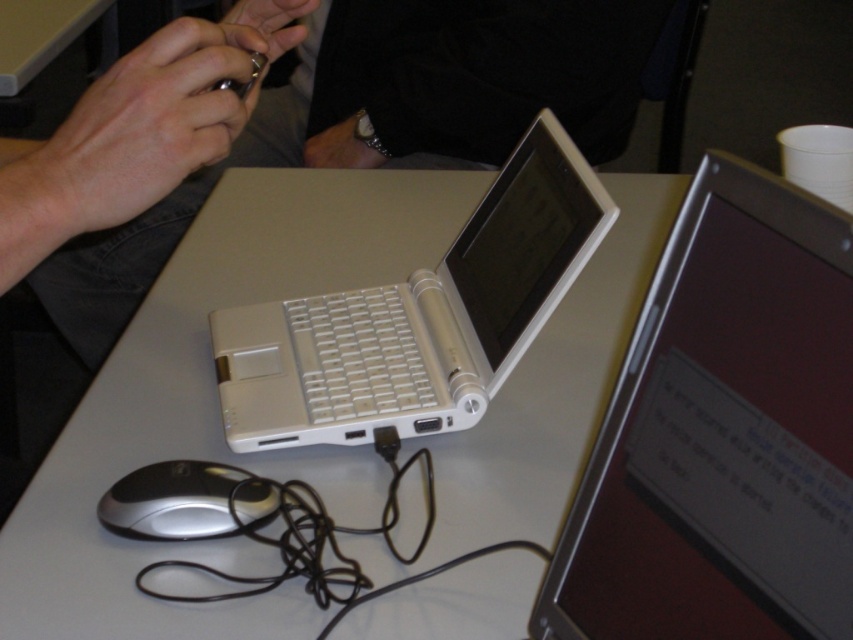
Question: Based on their relative distances, which object is nearer to the silver/black plastic mouse at lower left?

Choices:
 (A) matte silver ring at upper left
 (B) white leather ring at center
 (C) silver metallic laptop at center
 (D) metallic silver ring at upper center

Answer: (A)

Question: Does white plastic laptop at center have a smaller size compared to matte silver ring at upper left?

Choices:
 (A) no
 (B) yes

Answer: (A)

Question: Which point is farther from the camera taking this photo?

Choices:
 (A) (164, 129)
 (B) (149, 364)
 (C) (308, 435)
 (D) (302, 154)

Answer: (D)

Question: Estimate the real-world distances between objects in this image. Which object is farther from the silver/black plastic mouse at lower left?

Choices:
 (A) white plastic table at center
 (B) white plastic laptop at center
 (C) matte silver ring at upper left

Answer: (A)

Question: In this image, where is white plastic table at center located relative to white leather ring at center?

Choices:
 (A) below
 (B) above

Answer: (A)

Question: Can you confirm if white plastic table at center is wider than matte silver ring at upper left?

Choices:
 (A) yes
 (B) no

Answer: (A)